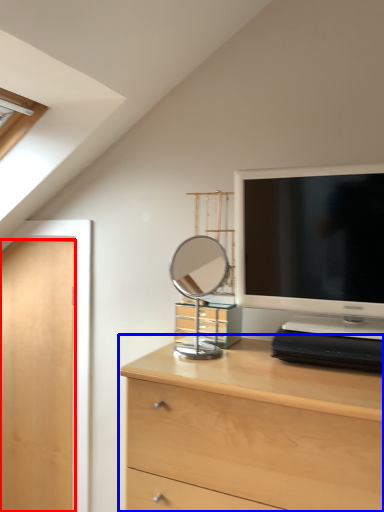
Question: Which object appears closest to the camera in this image, door (highlighted by a red box) or chest of drawers (highlighted by a blue box)?

Choices:
 (A) door
 (B) chest of drawers

Answer: (B)